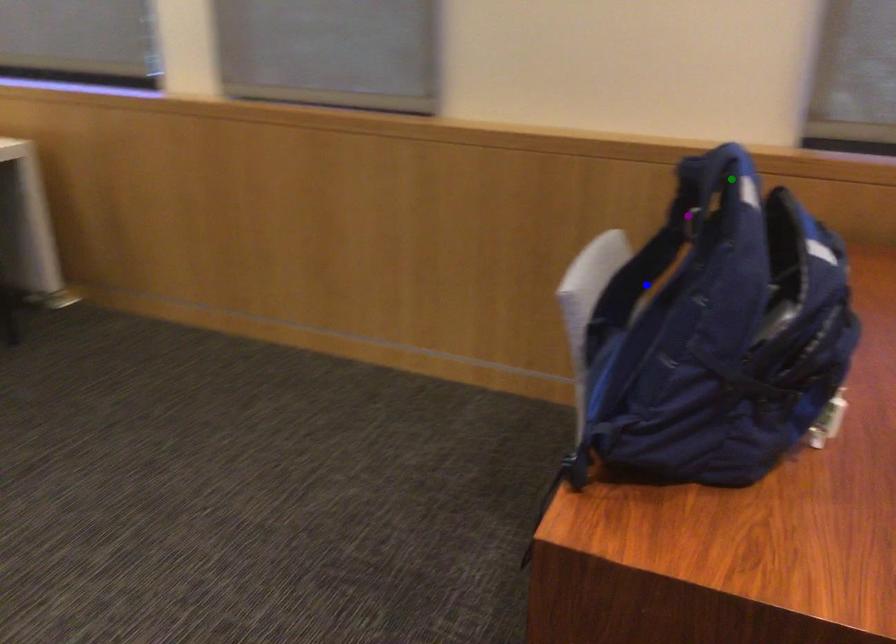
Order these from nearest to farthest:
- purple point
- green point
- blue point

blue point, purple point, green point